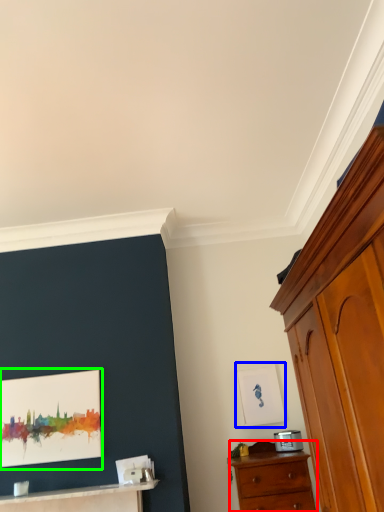
Question: Considering the real-world distances, which object is farthest from chest of drawers (highlighted by a red box)? picture frame (highlighted by a blue box) or picture frame (highlighted by a green box)?

Choices:
 (A) picture frame
 (B) picture frame

Answer: (B)